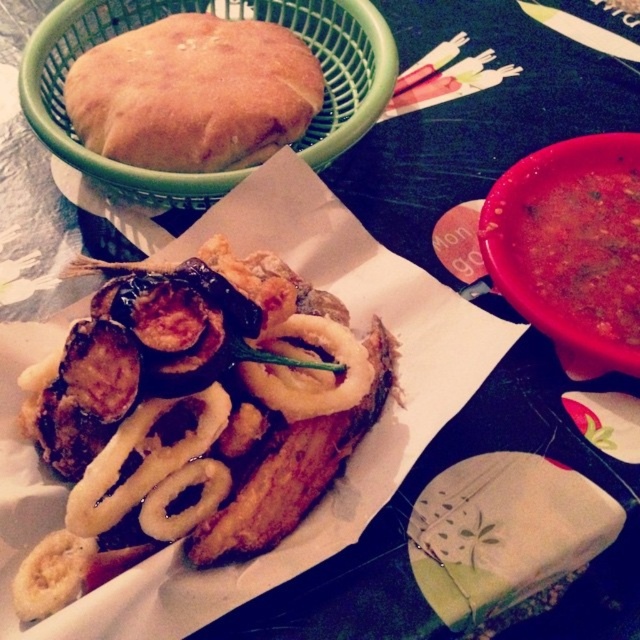
Question: Can you confirm if golden brown bread at upper left is wider than thick tomato soup at right?

Choices:
 (A) no
 (B) yes

Answer: (B)

Question: Does golden crispy onion rings at center appear under thick tomato soup at right?

Choices:
 (A) no
 (B) yes

Answer: (B)

Question: Can you confirm if golden crispy onion rings at center is smaller than golden brown bread at upper left?

Choices:
 (A) yes
 (B) no

Answer: (B)

Question: Which of the following is the closest to the observer?

Choices:
 (A) golden brown bread at upper left
 (B) golden crispy onion rings at center

Answer: (B)

Question: Among these points, which one is nearest to the camera?

Choices:
 (A) (35, 404)
 (B) (534, 225)

Answer: (A)

Question: Which object appears farthest from the camera in this image?

Choices:
 (A) golden brown bread at upper left
 (B) thick tomato soup at right

Answer: (A)